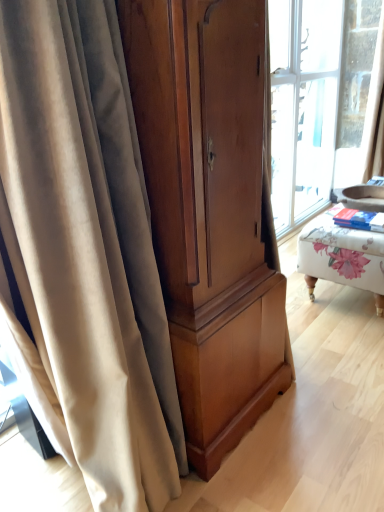
Question: Are beige velvet curtain at left and matte wood cabinet at center far apart?

Choices:
 (A) no
 (B) yes

Answer: (A)

Question: Considering the relative sizes of beige velvet curtain at left and matte wood cabinet at center in the image provided, is beige velvet curtain at left bigger than matte wood cabinet at center?

Choices:
 (A) no
 (B) yes

Answer: (A)

Question: Does beige velvet curtain at left come in front of matte wood cabinet at center?

Choices:
 (A) no
 (B) yes

Answer: (B)

Question: From the image's perspective, would you say beige velvet curtain at left is positioned over matte wood cabinet at center?

Choices:
 (A) no
 (B) yes

Answer: (A)

Question: Considering the relative positions of beige velvet curtain at left and matte wood cabinet at center in the image provided, is beige velvet curtain at left to the right of matte wood cabinet at center from the viewer's perspective?

Choices:
 (A) yes
 (B) no

Answer: (B)

Question: From a real-world perspective, is beige velvet curtain at left physically below matte wood cabinet at center?

Choices:
 (A) yes
 (B) no

Answer: (A)

Question: Is floral fabric ottoman at right shorter than matte wood cabinet at center?

Choices:
 (A) no
 (B) yes

Answer: (B)

Question: Can you confirm if floral fabric ottoman at right is wider than matte wood cabinet at center?

Choices:
 (A) no
 (B) yes

Answer: (B)

Question: Is floral fabric ottoman at right oriented away from matte wood cabinet at center?

Choices:
 (A) no
 (B) yes

Answer: (A)

Question: Is floral fabric ottoman at right with matte wood cabinet at center?

Choices:
 (A) no
 (B) yes

Answer: (A)

Question: From the image's perspective, is floral fabric ottoman at right located above matte wood cabinet at center?

Choices:
 (A) no
 (B) yes

Answer: (B)

Question: Is floral fabric ottoman at right closer to the viewer compared to matte wood cabinet at center?

Choices:
 (A) no
 (B) yes

Answer: (A)

Question: From the image's perspective, is matte wood cabinet at center above floral fabric ottoman at right?

Choices:
 (A) yes
 (B) no

Answer: (B)